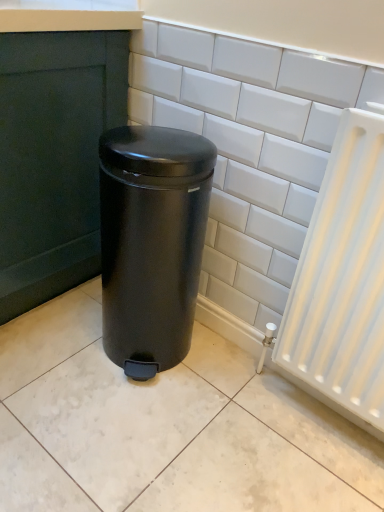
Question: Is point (321, 170) positioned closer to the camera than point (114, 310)?

Choices:
 (A) farther
 (B) closer

Answer: (B)

Question: Looking at the image, does white glossy tile at center seem bigger or smaller compared to matte black trash can at center?

Choices:
 (A) small
 (B) big

Answer: (A)

Question: Would you say white glossy tile at center is to the left or to the right of matte black trash can at center in the picture?

Choices:
 (A) left
 (B) right

Answer: (B)

Question: Do you think matte black trash can at center is within white glossy tile at center, or outside of it?

Choices:
 (A) outside
 (B) inside

Answer: (A)

Question: Is matte black trash can at center taller or shorter than white glossy tile at center?

Choices:
 (A) tall
 (B) short

Answer: (B)

Question: Is point (140, 185) closer or farther from the camera than point (157, 41)?

Choices:
 (A) closer
 (B) farther

Answer: (A)

Question: Is matte black trash can at center to the left or to the right of white glossy tile at center in the image?

Choices:
 (A) left
 (B) right

Answer: (A)